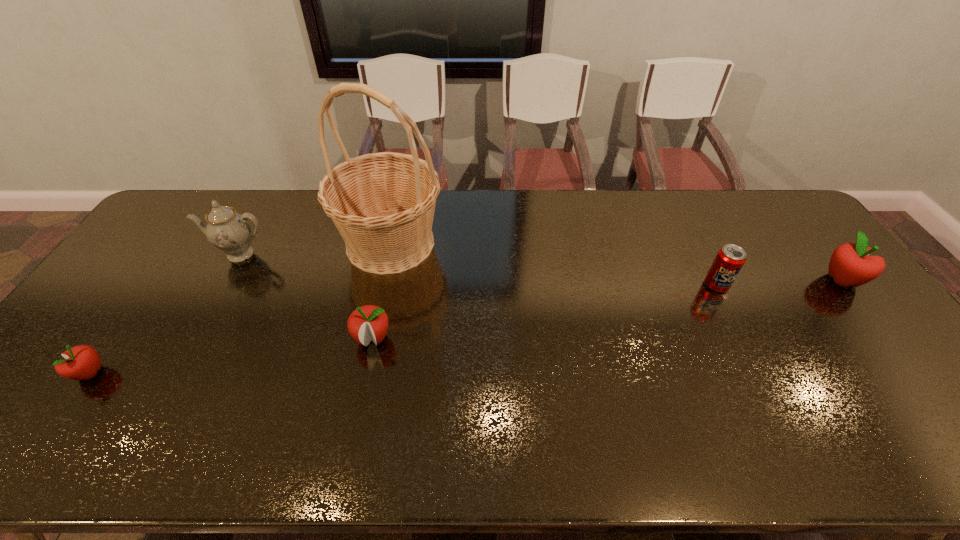
This screenshot has height=540, width=960. Identify the location of vacant region located on the back of the nearest apple. (168, 264).

Image resolution: width=960 pixels, height=540 pixels. I want to click on vacant space positioned on the back of the second farthest apple, so click(385, 276).

Where is `vacant region located 0.050m on the front of the tallest apple`? The width and height of the screenshot is (960, 540). vacant region located 0.050m on the front of the tallest apple is located at coordinates (864, 309).

The image size is (960, 540). Identify the location of vacant space located on the right of the tallest object. (494, 243).

Where is `free region located 0.170m on the spout of the chinaware`? free region located 0.170m on the spout of the chinaware is located at coordinates (209, 310).

The height and width of the screenshot is (540, 960). What are the coordinates of `vacant space located on the front of the soda can` in the screenshot? It's located at (736, 324).

Find the location of `object that is at the far edge`. object that is at the far edge is located at coordinates (383, 204).

You are a GUI agent. You are given a task and a screenshot of the screen. Output one action in this format:
    pyautogui.click(x=<x>, y=<y>)
    Task: Click on the object that is at the near edge
    
    Given the screenshot: What is the action you would take?
    pyautogui.click(x=82, y=362)

Where is `object at the left edge`? This screenshot has height=540, width=960. object at the left edge is located at coordinates [x=82, y=362].

What are the coordinates of `object that is at the right edge` in the screenshot? It's located at (850, 265).